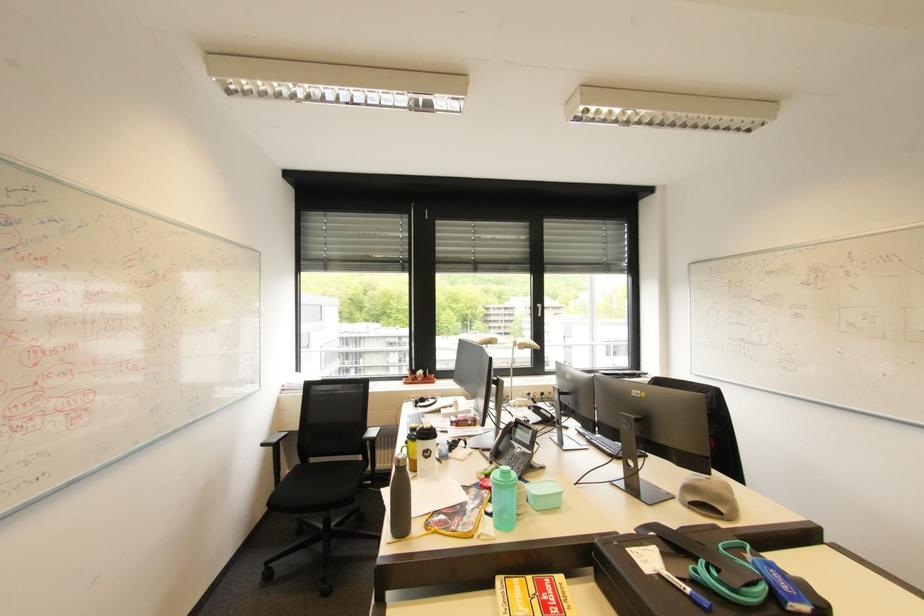
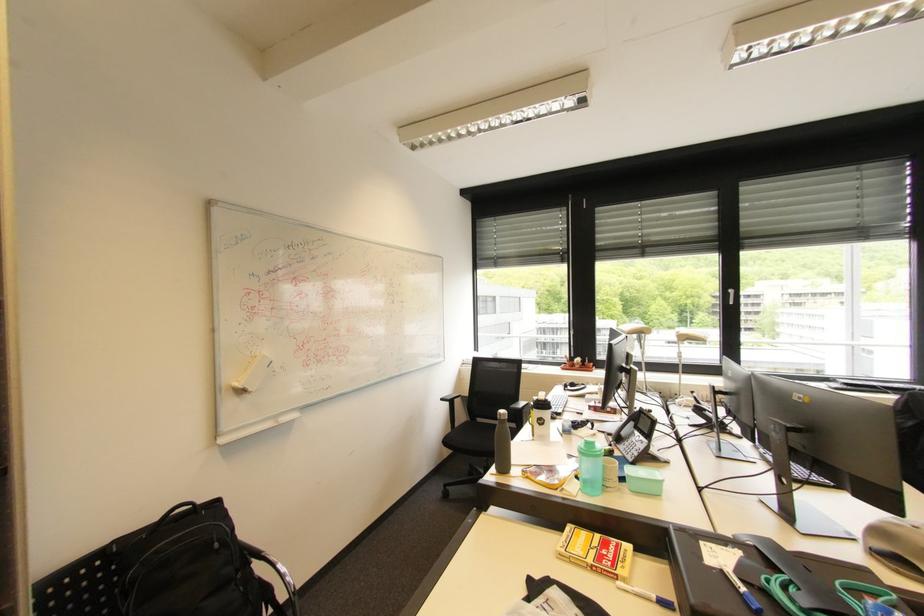
Question: Based on the continuous images, in which direction is the camera rotating? Reply with the corresponding letter.

Choices:
 (A) Left
 (B) Right
 (C) Up
 (D) Down

Answer: (A)